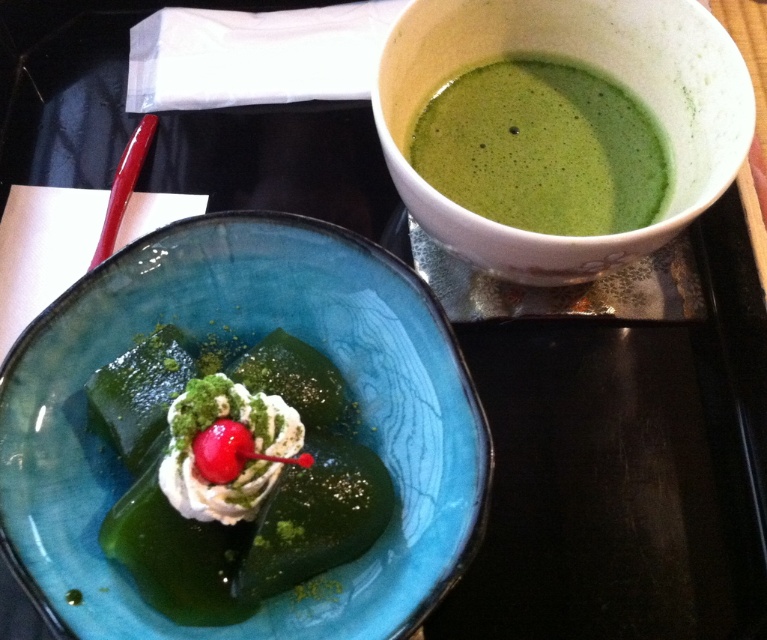
Question: Which point is closer to the camera taking this photo?

Choices:
 (A) (242, 236)
 (B) (542, 136)

Answer: (A)

Question: Which of the following is the closest to the observer?

Choices:
 (A) (137, 400)
 (B) (713, 140)

Answer: (A)

Question: Can you confirm if translucent glass bowl at center is wider than white ceramic bowl at upper right?

Choices:
 (A) yes
 (B) no

Answer: (A)

Question: Which point is closer to the camera?

Choices:
 (A) green gelatinous dessert at center
 (B) green frothy soup at upper right

Answer: (A)

Question: Does green gelatinous dessert at center appear on the left side of green frothy soup at upper right?

Choices:
 (A) no
 (B) yes

Answer: (B)

Question: Is white ceramic bowl at upper right above green frothy soup at upper right?

Choices:
 (A) yes
 (B) no

Answer: (A)